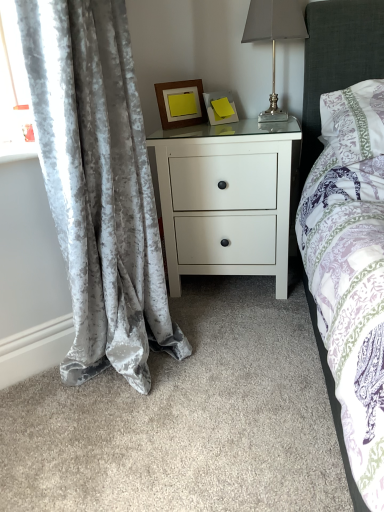
Question: Is white floral fabric pillow at upper right turned away from metallic silver table lamp at upper right?

Choices:
 (A) no
 (B) yes

Answer: (A)

Question: Does white floral fabric pillow at upper right appear on the right side of metallic silver table lamp at upper right?

Choices:
 (A) yes
 (B) no

Answer: (A)

Question: From the image's perspective, is white floral fabric pillow at upper right on top of metallic silver table lamp at upper right?

Choices:
 (A) no
 (B) yes

Answer: (A)

Question: From a real-world perspective, is white floral fabric pillow at upper right over metallic silver table lamp at upper right?

Choices:
 (A) yes
 (B) no

Answer: (B)

Question: Is white floral fabric pillow at upper right outside of metallic silver table lamp at upper right?

Choices:
 (A) yes
 (B) no

Answer: (A)

Question: Is white floral fabric pillow at upper right not near metallic silver table lamp at upper right?

Choices:
 (A) no
 (B) yes

Answer: (A)

Question: Could you tell me if velvet gray curtain at left is turned towards matte yellow picture frame at upper center, placed as the 1th picture frame when sorted from right to left?

Choices:
 (A) yes
 (B) no

Answer: (B)

Question: From the image's perspective, is velvet gray curtain at left located beneath matte yellow picture frame at upper center, the 2th picture frame in the left-to-right sequence?

Choices:
 (A) no
 (B) yes

Answer: (B)

Question: Considering the relative positions of velvet gray curtain at left and matte yellow picture frame at upper center, placed as the 1th picture frame when sorted from right to left, in the image provided, is velvet gray curtain at left to the left of matte yellow picture frame at upper center, placed as the 1th picture frame when sorted from right to left, from the viewer's perspective?

Choices:
 (A) no
 (B) yes

Answer: (B)

Question: Is matte yellow picture frame at upper center, placed as the 1th picture frame when sorted from right to left, at the back of velvet gray curtain at left?

Choices:
 (A) no
 (B) yes

Answer: (A)

Question: Is the position of velvet gray curtain at left more distant than that of matte yellow picture frame at upper center, the 2th picture frame in the left-to-right sequence?

Choices:
 (A) yes
 (B) no

Answer: (B)

Question: Can you confirm if velvet gray curtain at left is smaller than matte yellow picture frame at upper center, placed as the 1th picture frame when sorted from right to left?

Choices:
 (A) no
 (B) yes

Answer: (A)

Question: Is wooden frame at upper center, marked as the first picture frame in a left-to-right arrangement, shorter than white matte nightstand at center?

Choices:
 (A) no
 (B) yes

Answer: (B)